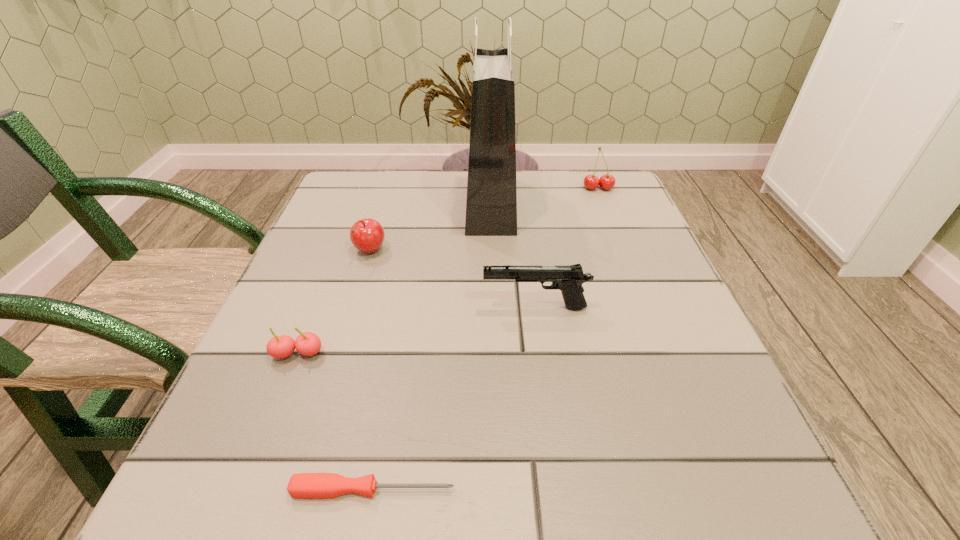
Locate an element on the screen. This screenshot has width=960, height=540. free region at the right edge is located at coordinates (703, 387).

In the image, there is a desktop. Where is `vacant space at the far left corner`? The height and width of the screenshot is (540, 960). vacant space at the far left corner is located at coordinates (392, 185).

The height and width of the screenshot is (540, 960). In the image, there is a desktop. What are the coordinates of `free region at the far right corner` in the screenshot? It's located at (565, 176).

The image size is (960, 540). In the image, there is a desktop. In order to click on free space at the near right corner in this screenshot , I will do `click(771, 490)`.

Find the location of a particular element. The width and height of the screenshot is (960, 540). vacant space that is in between the shortest object and the fourth farthest object is located at coordinates (454, 399).

The height and width of the screenshot is (540, 960). Find the location of `free spot between the rightmost cherry and the shortest cherry`. free spot between the rightmost cherry and the shortest cherry is located at coordinates (448, 271).

This screenshot has height=540, width=960. I want to click on blank region between the shortest cherry and the nearest object, so click(x=336, y=422).

Where is `free space between the tallest object and the rightmost object`? Image resolution: width=960 pixels, height=540 pixels. free space between the tallest object and the rightmost object is located at coordinates (544, 196).

The width and height of the screenshot is (960, 540). I want to click on vacant area between the third nearest object and the second farthest cherry, so click(452, 280).

I want to click on free space between the farthest cherry and the fourth farthest object, so click(566, 248).